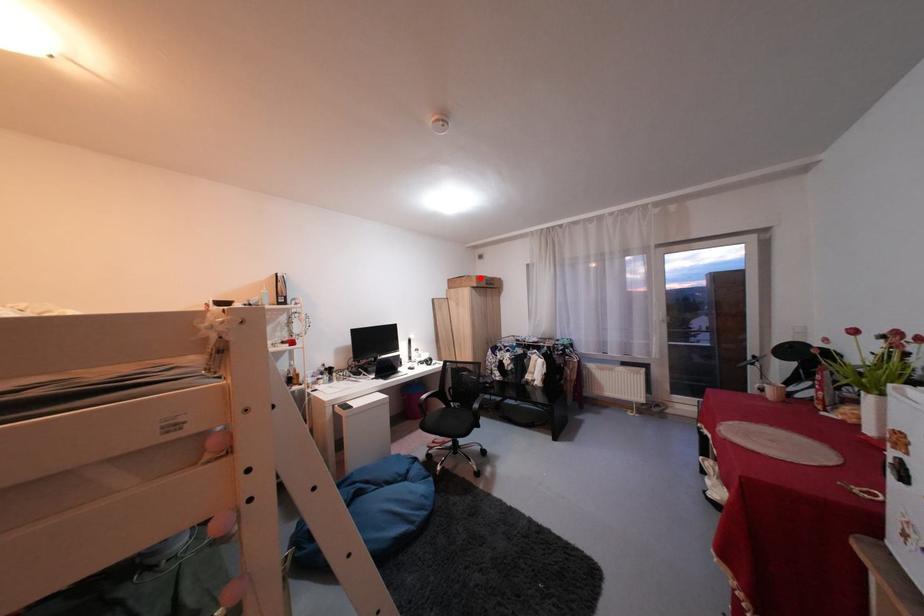
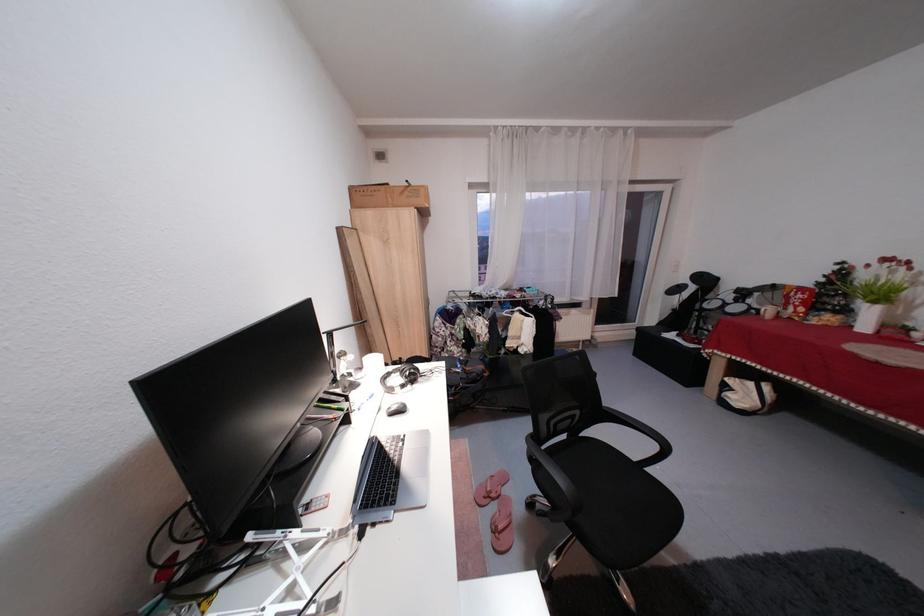
In the second image, find the point that corresponds to the highlighted location in the first image.

(420, 185)